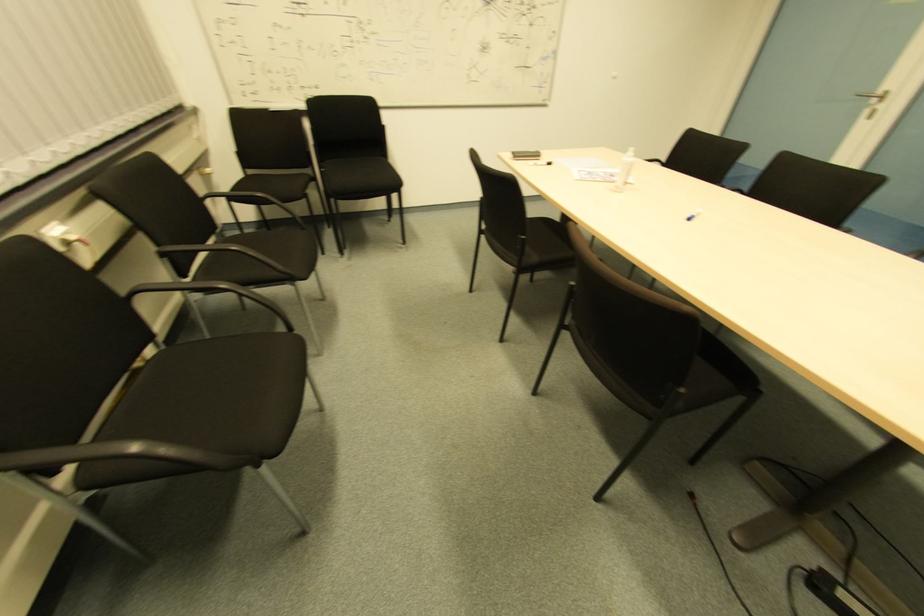
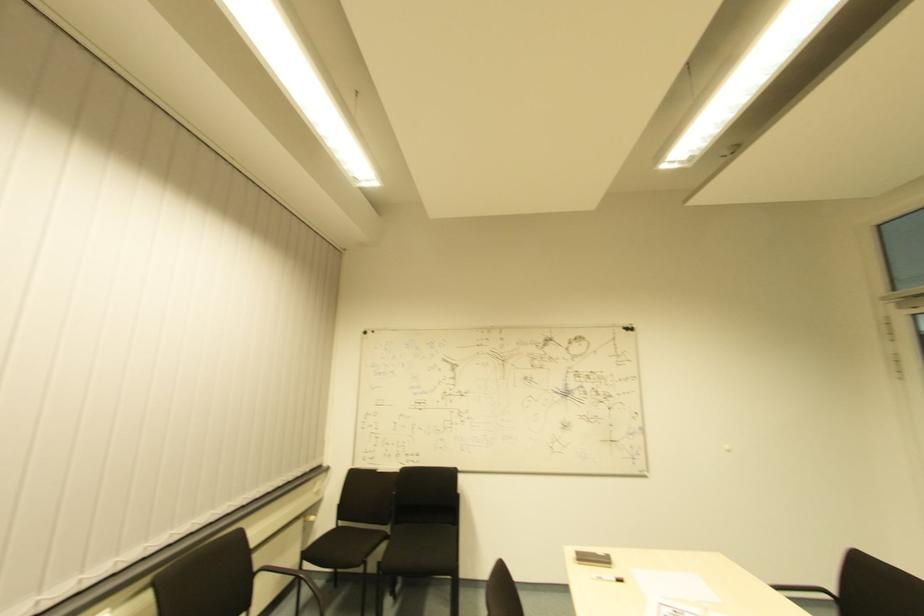
Based on the continuous images, in which direction is the camera rotating?

The rotation direction of the camera is left-up.